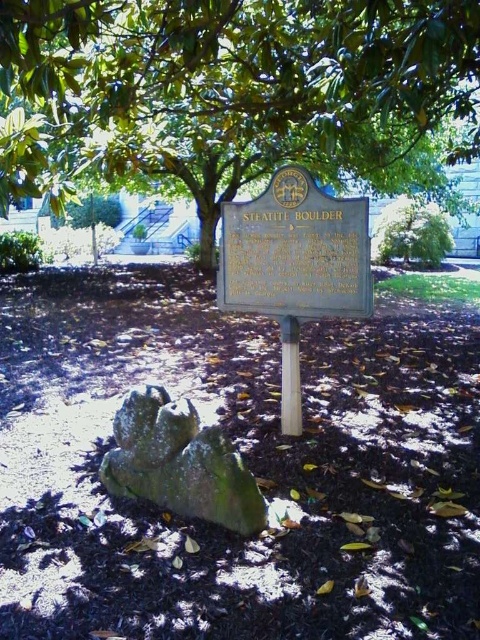
You are a park ranger inspecting the historical marker. You need to determine if the gold plaque at center can fit on a display stand that is the same size as the green mossy rock at center. Can it fit?

The gold plaque at center is wider than the green mossy rock at center, so it cannot fit on the display stand that is the same size as the green mossy rock at center.

You are a photographer wanting to capture both the green leafy tree at upper center and the gold plaque at center in a single frame. Based on their sizes, which object would appear larger in your photo?

The green leafy tree at upper center appears larger in the photo because it is taller than the gold plaque at center.

Consider the image. You are a park visitor standing near the historical marker. You notice the green leafy tree at upper center and the green mossy rock at center. Which object is higher up in the image?

The green leafy tree at upper center is higher up than the green mossy rock at center.